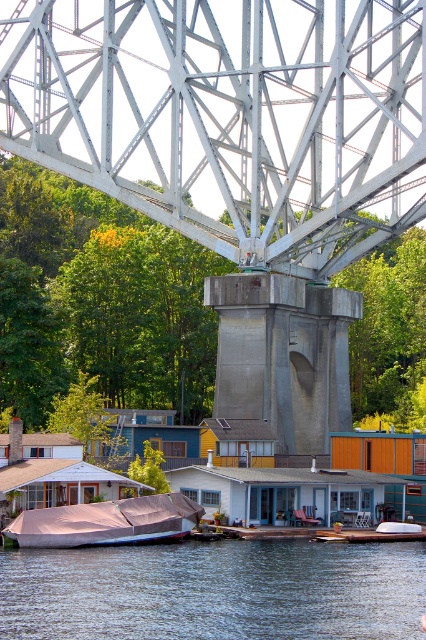
Is point (101, 8) positioned in front of point (92, 544)?

No, (101, 8) is behind (92, 544).

Can you confirm if metallic gray bridge at center is smaller than matte pink tarp at lower left?

No.

Based on the photo, measure the distance between metallic gray bridge at center and camera.

metallic gray bridge at center is 73.68 meters away from camera.

Locate an element on the screen. The height and width of the screenshot is (640, 426). metallic gray bridge at center is located at coordinates 230,116.

Does metallic gray bridge at center lie in front of blue water at lower center?

No.

Is metallic gray bridge at center below blue water at lower center?

Actually, metallic gray bridge at center is above blue water at lower center.

Locate an element on the screen. This screenshot has width=426, height=640. metallic gray bridge at center is located at coordinates (230, 116).

Who is more forward, (187, 612) or (28, 513)?

Point (187, 612) is more forward.

Who is positioned more to the left, blue water at lower center or matte pink tarp at lower left?

Positioned to the left is matte pink tarp at lower left.

Between point (379, 618) and point (72, 541), which one is positioned behind?

Positioned behind is point (72, 541).

Identify the location of blue water at lower center. (215, 589).